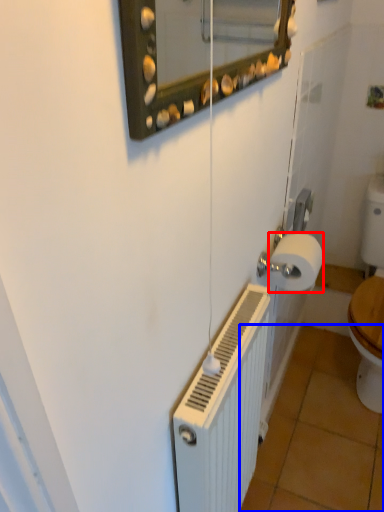
Question: Which of the following is the farthest to the observer, toilet paper (highlighted by a red box) or tile (highlighted by a blue box)?

Choices:
 (A) toilet paper
 (B) tile

Answer: (B)